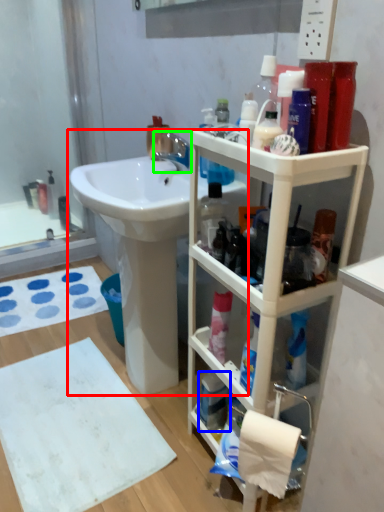
Question: Which is farther away from sink (highlighted by a red box)? mouthwash (highlighted by a blue box) or tap (highlighted by a green box)?

Choices:
 (A) mouthwash
 (B) tap

Answer: (A)